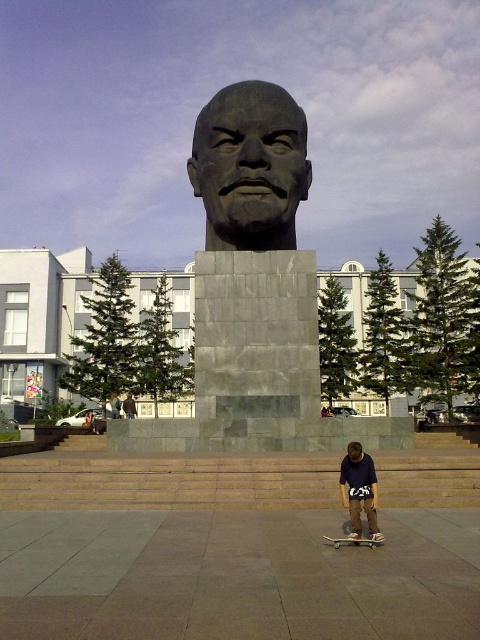
Does bronze statue at center come behind dark blue cotton shirt at lower center?

Yes.

Does bronze statue at center have a smaller size compared to dark blue cotton shirt at lower center?

Incorrect, bronze statue at center is not smaller in size than dark blue cotton shirt at lower center.

Between point (291, 221) and point (340, 484), which one is positioned behind?

The point (291, 221) is behind.

Locate an element on the screen. bronze statue at center is located at coordinates (250, 166).

Can you confirm if wooden skateboard at lower center is bigger than matte gray statue at center?

No, wooden skateboard at lower center is not bigger than matte gray statue at center.

Is wooden skateboard at lower center below matte gray statue at center?

Incorrect, wooden skateboard at lower center is not positioned below matte gray statue at center.

Which is behind, point (358, 538) or point (132, 404)?

Positioned behind is point (132, 404).

I want to click on wooden skateboard at lower center, so click(354, 541).

The width and height of the screenshot is (480, 640). I want to click on dark blue cotton shirt at lower center, so click(360, 492).

Is dark blue cotton shirt at lower center bigger than matte gray statue at center?

Incorrect, dark blue cotton shirt at lower center is not larger than matte gray statue at center.

Image resolution: width=480 pixels, height=640 pixels. I want to click on dark blue cotton shirt at lower center, so click(x=360, y=492).

The width and height of the screenshot is (480, 640). I want to click on dark blue cotton shirt at lower center, so click(x=360, y=492).